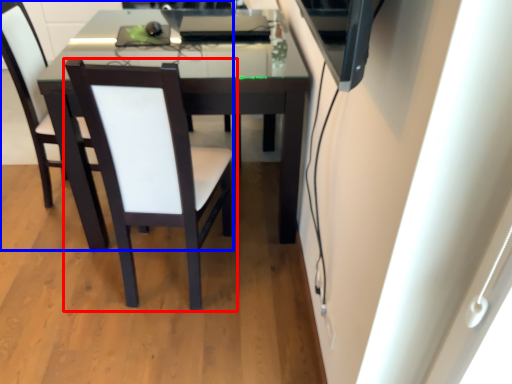
Question: Which object is further to the camera taking this photo, chair (highlighted by a red box) or chair (highlighted by a blue box)?

Choices:
 (A) chair
 (B) chair

Answer: (B)